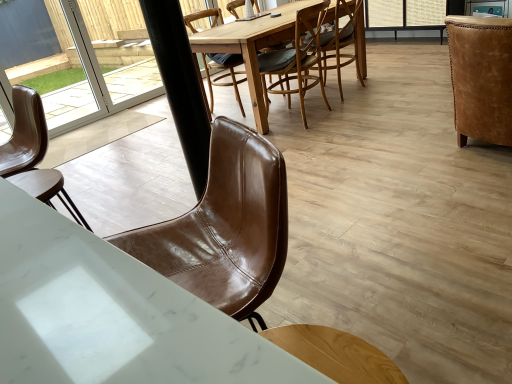
Locate an element on the screen. Image resolution: width=512 pixels, height=384 pixels. vacant space to the left of leather armchair at right, placed as the 5th chair when sorted from left to right is located at coordinates (394, 157).